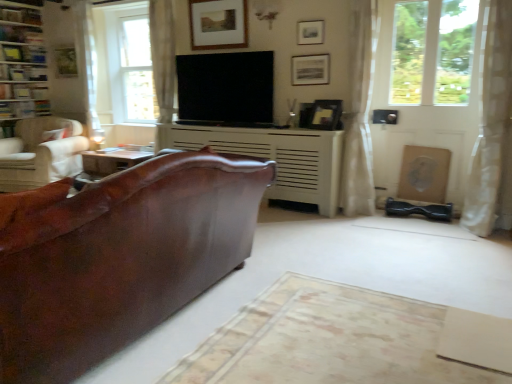
What do you see at coordinates (310, 69) in the screenshot?
I see `matte black picture frame at upper center, the 4th picture frame in the left-to-right sequence` at bounding box center [310, 69].

Image resolution: width=512 pixels, height=384 pixels. I want to click on matte wooden picture frame at upper center, the second picture frame viewed from the back, so click(218, 24).

This screenshot has width=512, height=384. Describe the element at coordinates (117, 257) in the screenshot. I see `brown leather couch at center` at that location.

What do you see at coordinates (226, 89) in the screenshot? Image resolution: width=512 pixels, height=384 pixels. I see `flat screen tv at center` at bounding box center [226, 89].

In order to face flat screen tv at center, should I rotate leftwards or rightwards?

You should rotate left by 4.670 degrees.

Where is `white wooden tv cabinet at upper center`? white wooden tv cabinet at upper center is located at coordinates (22, 64).

Considering the positions of points (198, 42) and (309, 69), is point (198, 42) farther from camera compared to point (309, 69)?

Yes.

In the image, is matte wooden picture frame at upper center, the second picture frame viewed from the back, positioned in front of or behind matte black picture frame at upper center, which is the second picture frame in front-to-back order?

Visually, matte wooden picture frame at upper center, the second picture frame viewed from the back, is located behind matte black picture frame at upper center, which is the second picture frame in front-to-back order.

Based on the photo, can you confirm if matte wooden picture frame at upper center, the third picture frame positioned from the front, is positioned to the left of matte black picture frame at upper center, which is the second picture frame in front-to-back order?

Indeed, matte wooden picture frame at upper center, the third picture frame positioned from the front, is positioned on the left side of matte black picture frame at upper center, which is the second picture frame in front-to-back order.

From a real-world perspective, is matte black picture frame at upper center, which is counted as the 2th picture frame, starting from the right, above or below white sheer curtain at right, placed as the 2th curtain when sorted from right to left?

From a real-world perspective, matte black picture frame at upper center, which is counted as the 2th picture frame, starting from the right, is physically above white sheer curtain at right, placed as the 2th curtain when sorted from right to left.

Which object is positioned more to the left, matte black picture frame at upper center, which ranks as the 3th picture frame in left-to-right order, or white sheer curtain at right, placed as the 2th curtain when sorted from right to left?

matte black picture frame at upper center, which ranks as the 3th picture frame in left-to-right order.

Is matte black picture frame at upper center, the first picture frame from the front, aimed at white sheer curtain at right, which ranks as the first curtain in left-to-right order?

No, matte black picture frame at upper center, the first picture frame from the front, is not aimed at white sheer curtain at right, which ranks as the first curtain in left-to-right order.

Based on the photo, would you say matte black picture frame at upper center, the 4th picture frame viewed from the back, is outside white sheer curtain at right, which ranks as the first curtain in left-to-right order?

matte black picture frame at upper center, the 4th picture frame viewed from the back, lies outside white sheer curtain at right, which ranks as the first curtain in left-to-right order,'s area.

Which is correct: flat screen tv at center is inside matte gold picture frame at upper left, arranged as the fourth picture frame when viewed from the right, or outside of it?

flat screen tv at center is located beyond the bounds of matte gold picture frame at upper left, arranged as the fourth picture frame when viewed from the right.

What's the angular difference between flat screen tv at center and matte gold picture frame at upper left, arranged as the fourth picture frame when viewed from the right,'s facing directions?

They differ by 0.874 degrees in their facing directions.

From a real-world perspective, which is physically above, flat screen tv at center or matte gold picture frame at upper left, marked as the 1th picture frame in a back-to-front arrangement?

matte gold picture frame at upper left, marked as the 1th picture frame in a back-to-front arrangement.

Which object is positioned more to the right, flat screen tv at center or matte gold picture frame at upper left, marked as the 1th picture frame in a back-to-front arrangement?

Positioned to the right is flat screen tv at center.

Considering the positions of point (127, 151) and point (318, 34), is point (127, 151) closer or farther from the camera than point (318, 34)?

Point (127, 151) is farther from the camera than point (318, 34).

Does brown leather table at left turn towards matte black picture frame at upper center, the 4th picture frame viewed from the back?

No.

How many degrees apart are the facing directions of brown leather table at left and matte black picture frame at upper center, the first picture frame from the front?

The angle between the facing direction of brown leather table at left and the facing direction of matte black picture frame at upper center, the first picture frame from the front, is 0.355 degrees.

Consider the image. Considering the relative sizes of brown leather table at left and matte black picture frame at upper center, the first picture frame from the front, in the image provided, is brown leather table at left wider than matte black picture frame at upper center, the first picture frame from the front,?

Yes, brown leather table at left is wider than matte black picture frame at upper center, the first picture frame from the front.

How many degrees apart are the facing directions of beige carpet at center and flat screen tv at center?

The angular difference between beige carpet at center and flat screen tv at center is 90.2 degrees.

Is beige carpet at center oriented towards flat screen tv at center?

No, beige carpet at center is not oriented towards flat screen tv at center.

From the image's perspective, between beige carpet at center and flat screen tv at center, which one is located above?

flat screen tv at center.

There is a matte black picture frame at upper center, the 1th picture frame when ordered from right to left. Identify the location of the 1st picture frame above it (from a real-world perspective). The height and width of the screenshot is (384, 512). (65, 62).

From a real-world perspective, which is physically above, matte gold picture frame at upper left, marked as the 1th picture frame in a back-to-front arrangement, or matte black picture frame at upper center, which is the second picture frame in front-to-back order?

matte gold picture frame at upper left, marked as the 1th picture frame in a back-to-front arrangement.

Is matte gold picture frame at upper left, arranged as the fourth picture frame when viewed from the right, positioned with its back to matte black picture frame at upper center, which is the second picture frame in front-to-back order?

No, matte gold picture frame at upper left, arranged as the fourth picture frame when viewed from the right, is not facing the opposite direction of matte black picture frame at upper center, which is the second picture frame in front-to-back order.

Choose the correct answer: Is matte black picture frame at upper center, the 4th picture frame in the left-to-right sequence, inside matte wooden picture frame at upper center, the third picture frame positioned from the front, or outside it?

matte black picture frame at upper center, the 4th picture frame in the left-to-right sequence, cannot be found inside matte wooden picture frame at upper center, the third picture frame positioned from the front.

From a real-world perspective, which object rests below the other?

matte black picture frame at upper center, the 4th picture frame in the left-to-right sequence.

Measure the distance between matte black picture frame at upper center, the 4th picture frame in the left-to-right sequence, and matte wooden picture frame at upper center, the third picture frame positioned from the front.

A distance of 36.66 inches exists between matte black picture frame at upper center, the 4th picture frame in the left-to-right sequence, and matte wooden picture frame at upper center, the third picture frame positioned from the front.

Is matte black picture frame at upper center, which is the second picture frame in front-to-back order, aimed at matte wooden picture frame at upper center, the third picture frame positioned from the front?

No.

You are a GUI agent. You are given a task and a screenshot of the screen. Output one action in this format:
    pyautogui.click(x=<x>, y=<y>)
    Task: Click on the picture frame that is the 3rd object above the matte black picture frame at upper center, the 4th picture frame in the left-to-right sequence (from a real-world perspective)
    
    Given the screenshot: What is the action you would take?
    pyautogui.click(x=218, y=24)

From the image's perspective, which curtain is the 1st one below the matte black picture frame at upper center, the first picture frame from the front? Please provide its 2D coordinates.

[(359, 112)]

Estimate the real-world distances between objects in this image. Which object is further from beige carpet at center, matte gold picture frame at upper left, which is the 1th picture frame in left-to-right order, or brown leather table at left?

Based on the image, matte gold picture frame at upper left, which is the 1th picture frame in left-to-right order, appears to be further to beige carpet at center.

Based on their spatial positions, is white textured curtain at right, placed as the second curtain when sorted from left to right, or matte gold picture frame at upper left, arranged as the fourth picture frame when viewed from the right, further from beige carpet at center?

Among the two, matte gold picture frame at upper left, arranged as the fourth picture frame when viewed from the right, is located further to beige carpet at center.

Based on the photo, when comparing their distances from brown leather table at left, does flat screen tv at center or matte black picture frame at upper center, which is the second picture frame in front-to-back order, seem closer?

flat screen tv at center is closer to brown leather table at left.

From the image, which object appears to be nearer to brown leather table at left, flat screen tv at center or white sheer curtain at right, placed as the 2th curtain when sorted from right to left?

The object closer to brown leather table at left is flat screen tv at center.

Looking at the image, which one is located closer to white wooden tv cabinet at upper center, matte black picture frame at upper center, placed as the third picture frame when sorted from back to front, or white textured fireplace at center?

Among the two, white textured fireplace at center is located nearer to white wooden tv cabinet at upper center.

Based on their spatial positions, is clear glass window at upper left or white textured fireplace at center further from brown leather couch at center?

Based on the image, clear glass window at upper left appears to be further to brown leather couch at center.

Based on their spatial positions, is flat screen tv at center or beige carpet at center closer to clear glass window at upper left?

Among the two, flat screen tv at center is located nearer to clear glass window at upper left.

Estimate the real-world distances between objects in this image. Which object is further from beige carpet at center, white textured fireplace at center or brown leather couch at center?

white textured fireplace at center is further to beige carpet at center.

Find the location of a particular element. This screenshot has height=384, width=512. television between brown leather table at left and white textured curtain at right, placed as the second curtain when sorted from left to right, from left to right is located at coordinates (226, 89).

The height and width of the screenshot is (384, 512). Identify the location of television located between matte wooden picture frame at upper center, the third picture frame positioned from the front, and white textured curtain at right, which appears as the first curtain when viewed from the right, in the left-right direction. tap(226, 89).

What are the coordinates of `fireplace between beige carpet at center and matte wooden picture frame at upper center, the 2th picture frame positioned from the left, along the z-axis` in the screenshot? It's located at (274, 157).

This screenshot has height=384, width=512. I want to click on curtain situated between matte wooden picture frame at upper center, the second picture frame viewed from the back, and white textured curtain at right, which appears as the first curtain when viewed from the right, from left to right, so click(359, 112).